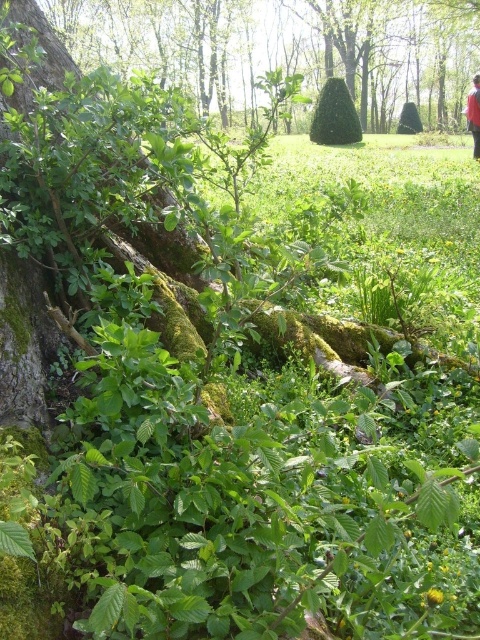
Which of these two, green mossy tree at upper left or red fabric person at upper right, stands shorter?

red fabric person at upper right

Which is more to the right, green mossy tree at upper left or red fabric person at upper right?

From the viewer's perspective, red fabric person at upper right appears more on the right side.

Locate an element on the screen. This screenshot has width=480, height=640. green mossy tree at upper left is located at coordinates pyautogui.click(x=357, y=51).